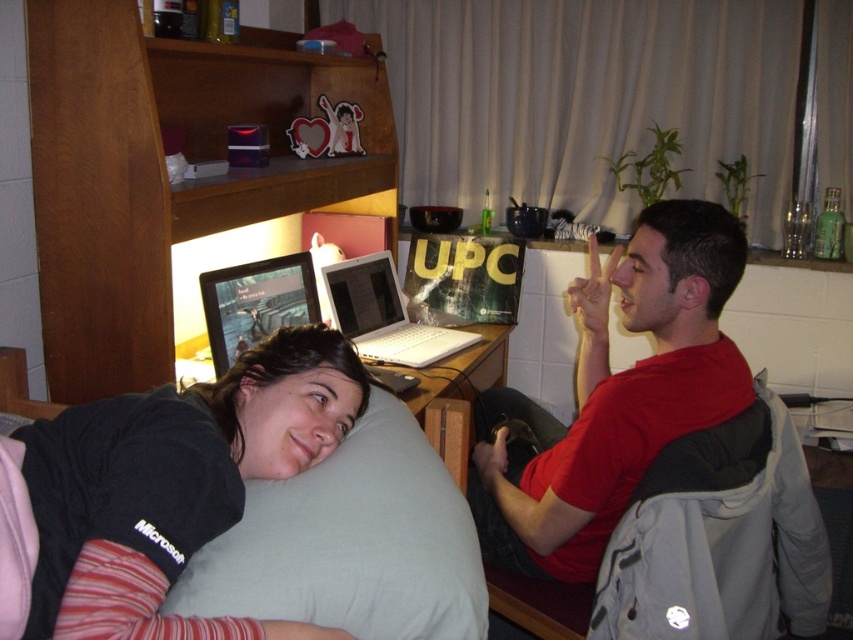
Does gray fabric pillow at lower left lie behind white plastic laptop at center?

No.

Can you confirm if gray fabric pillow at lower left is smaller than white plastic laptop at center?

Yes, gray fabric pillow at lower left is smaller than white plastic laptop at center.

Between point (451, 616) and point (343, 300), which one is positioned in front?

Point (451, 616)

The width and height of the screenshot is (853, 640). I want to click on gray fabric pillow at lower left, so click(351, 541).

Does red matte shirt at center appear on the left side of white plastic laptop at center?

No, red matte shirt at center is not to the left of white plastic laptop at center.

Is red matte shirt at center taller than white plastic laptop at center?

Indeed, red matte shirt at center has a greater height compared to white plastic laptop at center.

Locate an element on the screen. This screenshot has height=640, width=853. red matte shirt at center is located at coordinates (616, 394).

Locate an element on the screen. The width and height of the screenshot is (853, 640). red matte shirt at center is located at coordinates (616, 394).

Is point (131, 596) more distant than point (595, 353)?

No, (131, 596) is in front of (595, 353).

Who is positioned more to the right, black fabric pillow at lower left or red matte shirt at center?

From the viewer's perspective, red matte shirt at center appears more on the right side.

Does point (315, 419) lie behind point (471, 497)?

No, (315, 419) is in front of (471, 497).

The height and width of the screenshot is (640, 853). Find the location of `black fabric pillow at lower left`. black fabric pillow at lower left is located at coordinates (175, 484).